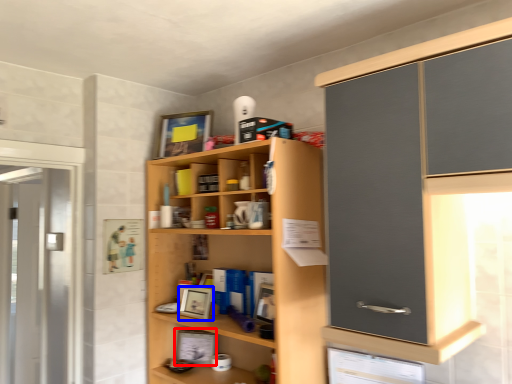
Question: Which of the following is the farthest to the observer, picture frame (highlighted by a red box) or picture frame (highlighted by a blue box)?

Choices:
 (A) picture frame
 (B) picture frame

Answer: (A)